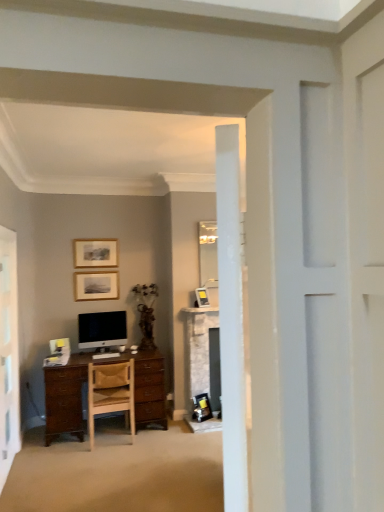
Locate an element on the screen. The height and width of the screenshot is (512, 384). free space above wooden picture frame at upper center, the first picture frame when ordered from left to right (from a real-world perspective) is located at coordinates (105, 234).